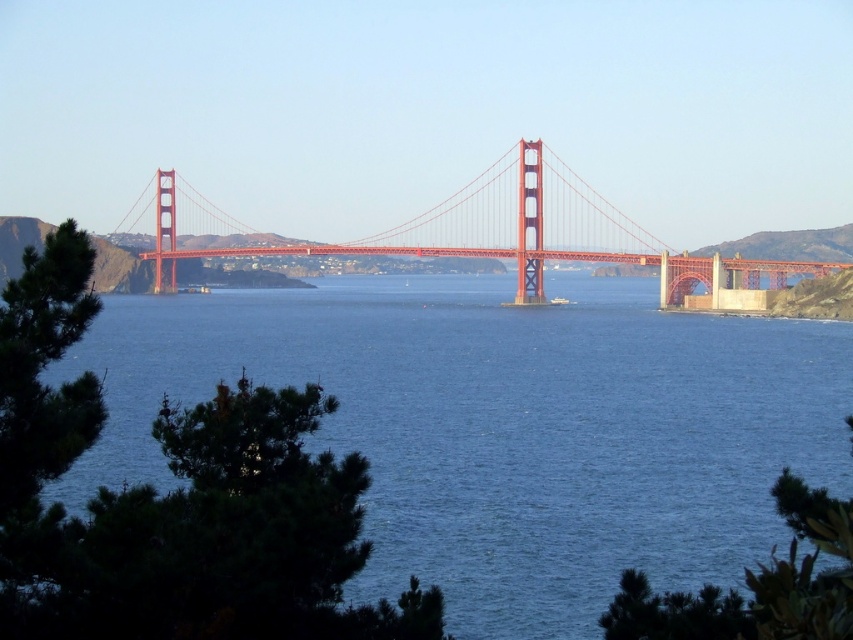
In the scene shown: You are a photographer planning to capture the Golden Gate Bridge in San Francisco. You notice the blue water at center and the green matte tree at center in your shot. Which object will occupy more space in your photograph?

The blue water at center is bigger than the green matte tree at center, so it will occupy more space in the photograph.

You are a photographer planning to capture the Golden Gate Bridge from a hillside vantage point. You notice the blue water at center and the green matte tree at center in your frame. Which object appears larger in the image?

The blue water at center appears larger than the green matte tree at center because it is taller according to the description.